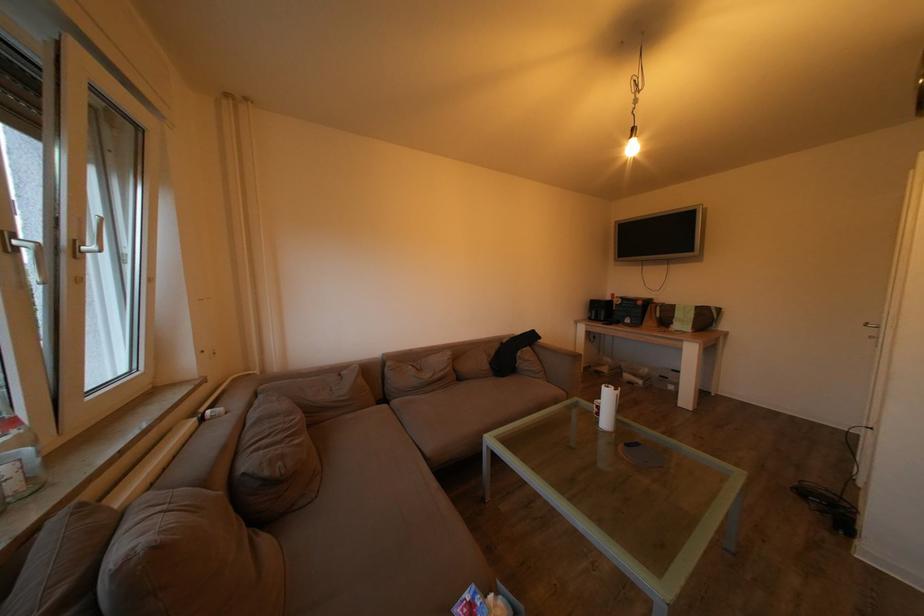
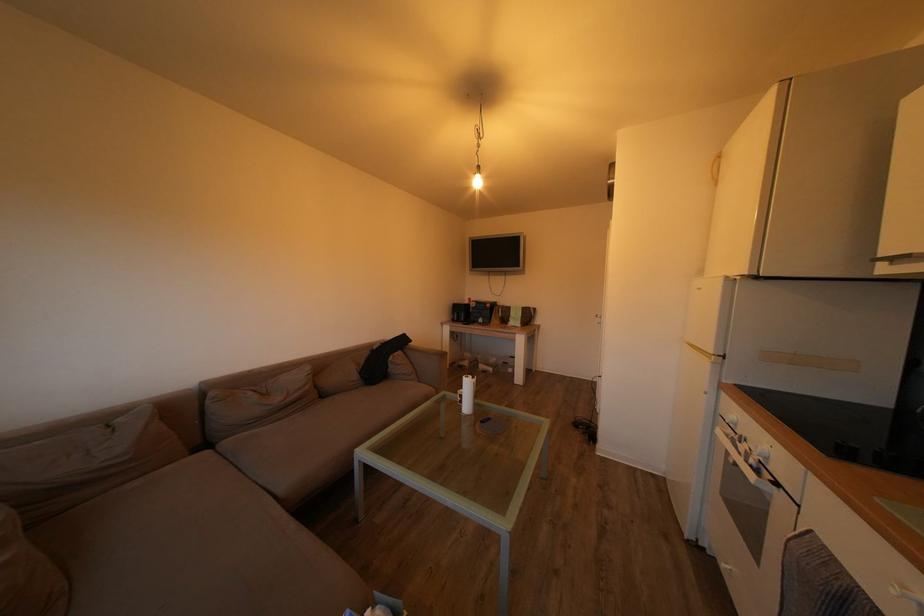
Find the pixel in the second image that matches [493,371] in the first image.

(362, 382)